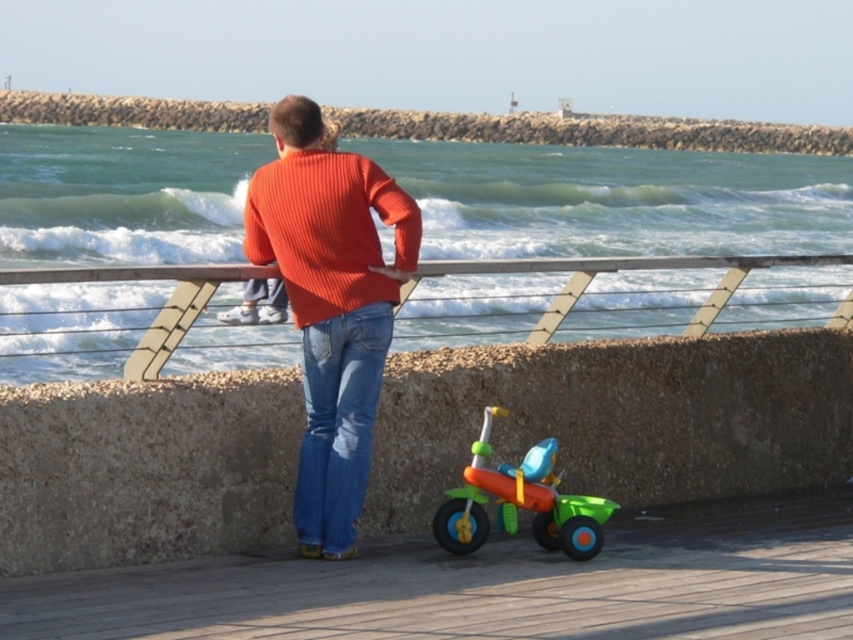
Question: Does metallic gray rail at center have a smaller size compared to blue denim jeans at center?

Choices:
 (A) no
 (B) yes

Answer: (A)

Question: Can you confirm if orange ribbed sweater at center is positioned to the left of green plastic tricycle at lower center?

Choices:
 (A) no
 (B) yes

Answer: (B)

Question: Which of these objects is positioned closest to the metallic gray rail at center?

Choices:
 (A) blue denim jeans at center
 (B) brushed concrete wall at upper center
 (C) green plastic tricycle at lower center

Answer: (A)

Question: Is the position of blue denim jeans at center less distant than that of green plastic tricycle at lower center?

Choices:
 (A) no
 (B) yes

Answer: (B)

Question: Among these objects, which one is nearest to the camera?

Choices:
 (A) wooden dock at lower center
 (B) green plastic tricycle at lower center
 (C) orange ribbed sweater at center
 (D) metallic gray rail at center

Answer: (A)

Question: Among these objects, which one is farthest from the camera?

Choices:
 (A) brushed concrete wall at upper center
 (B) blue denim jeans at center
 (C) metallic gray rail at center

Answer: (A)